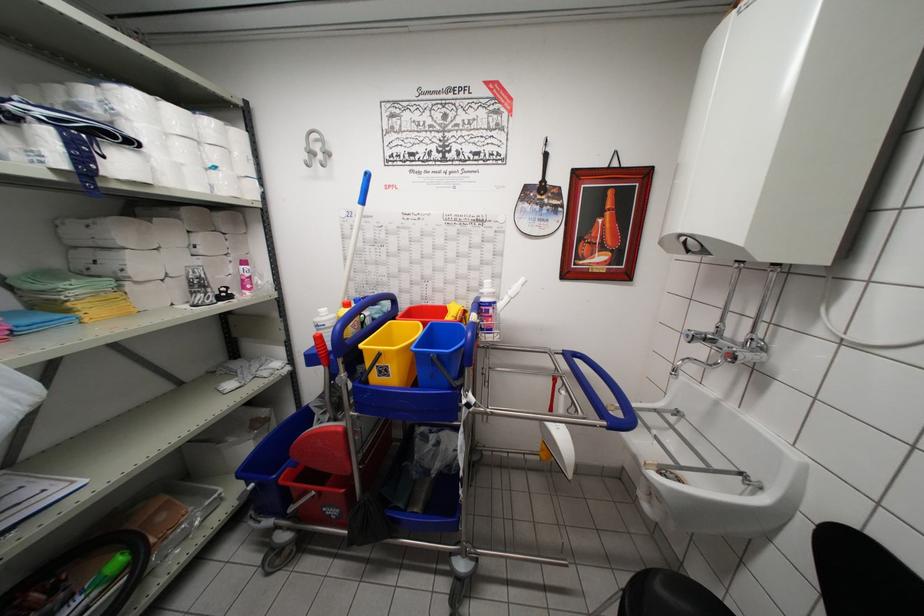
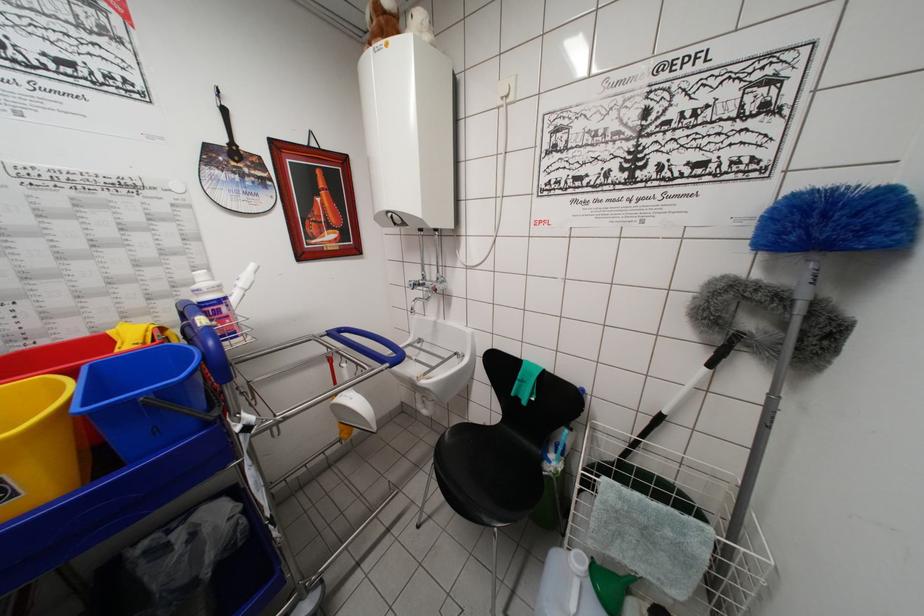
In the second image, find the point that corresponds to (x=649, y=468) in the first image.

(420, 383)